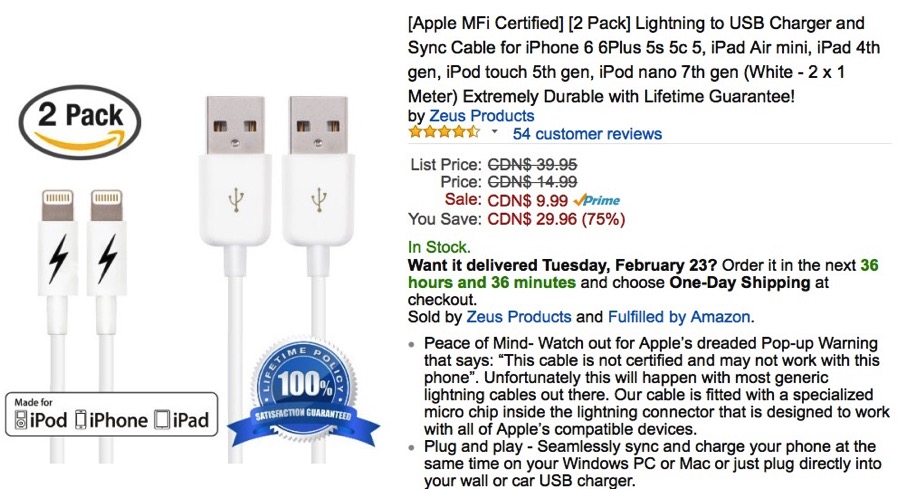
This screenshot has width=898, height=489. What are the coordinates of `usb plug` in the screenshot? It's located at (218, 144), (313, 137).